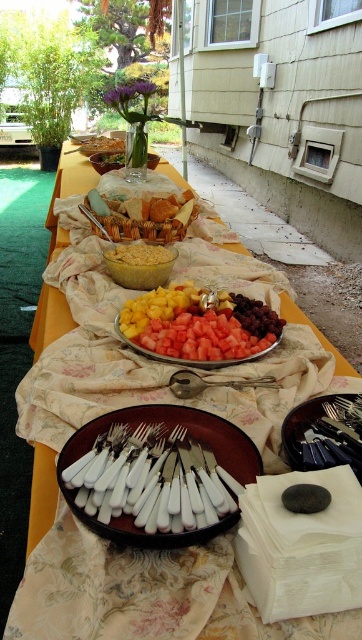
Can you confirm if white plastic forks at center is shorter than silver spoon at center?

In fact, white plastic forks at center may be taller than silver spoon at center.

Is point (146, 502) positioned before point (170, 387)?

That is True.

In order to click on white plastic forks at center in this screenshot , I will do `click(157, 474)`.

Between shiny red plate at center and silver spoon at center, which one has more height?

shiny red plate at center

Can you confirm if shiny red plate at center is taller than silver spoon at center?

Yes.

What do you see at coordinates (199, 326) in the screenshot? This screenshot has height=640, width=362. I see `shiny red plate at center` at bounding box center [199, 326].

What are the coordinates of `shiny red plate at center` in the screenshot? It's located at (199, 326).

Does white plastic forks at center appear on the right side of shiny red plate at center?

No, white plastic forks at center is not to the right of shiny red plate at center.

Is point (140, 547) positioned behind point (258, 328)?

That is False.

I want to click on white plastic forks at center, so 157,474.